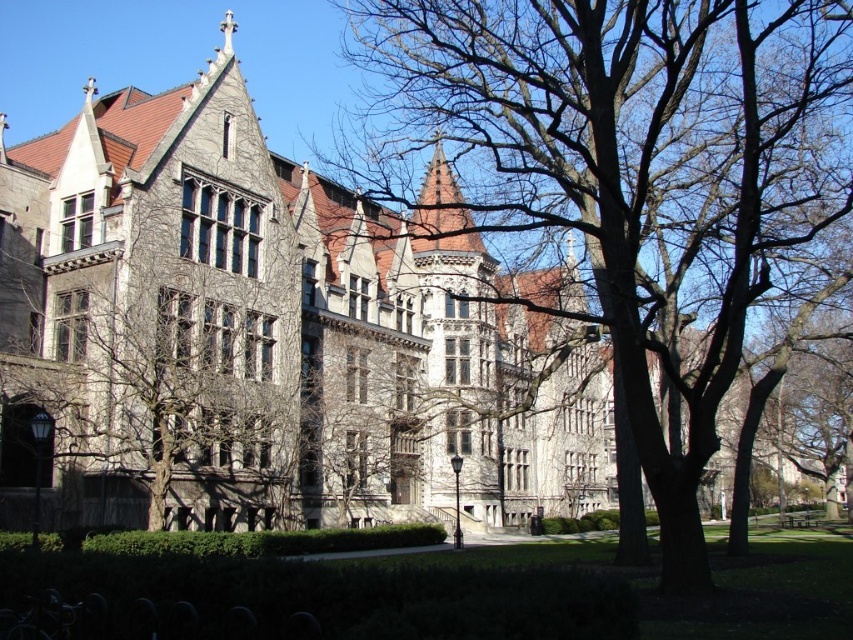
Question: Among these objects, which one is farthest from the camera?

Choices:
 (A) gray stone tree at center
 (B) brown bark tree at center

Answer: (A)

Question: Can you confirm if brown bark tree at center is wider than gray stone tree at center?

Choices:
 (A) no
 (B) yes

Answer: (B)

Question: Considering the relative positions of brown bark tree at center and gray stone tree at center in the image provided, where is brown bark tree at center located with respect to gray stone tree at center?

Choices:
 (A) above
 (B) below

Answer: (A)

Question: Which of the following is the closest to the observer?

Choices:
 (A) pos(747,168)
 (B) pos(253,456)

Answer: (A)

Question: Can you confirm if brown bark tree at center is smaller than gray stone tree at center?

Choices:
 (A) no
 (B) yes

Answer: (A)

Question: Which object is closer to the camera taking this photo?

Choices:
 (A) brown bark tree at center
 (B) gray stone tree at center

Answer: (A)